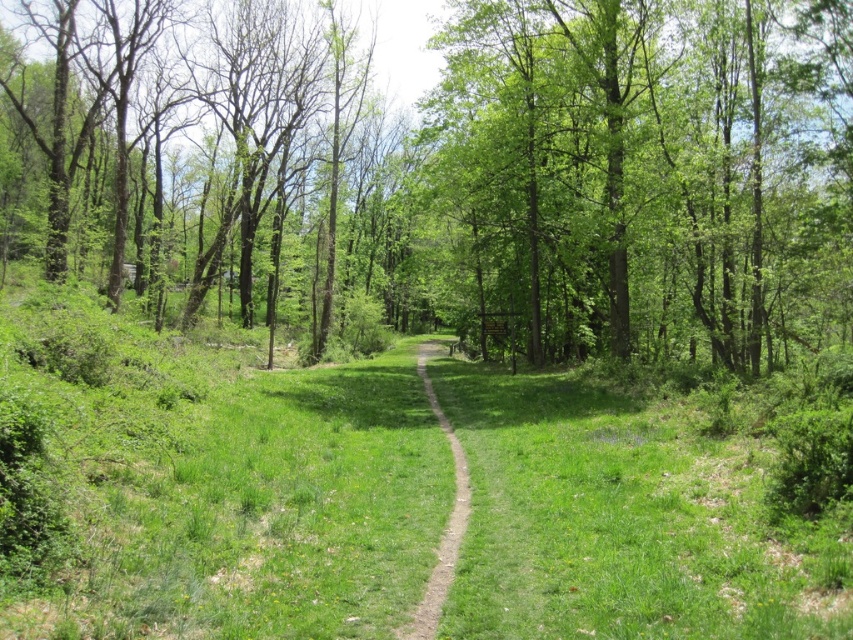
You are standing on the dirt path in the forest and see two points marked in the scene. The first point is at coordinate point (759,300) and the second is at point (445,580). Which point is closer to you?

Point (759,300) is closer to you because it is further to the viewer than point (445,580).